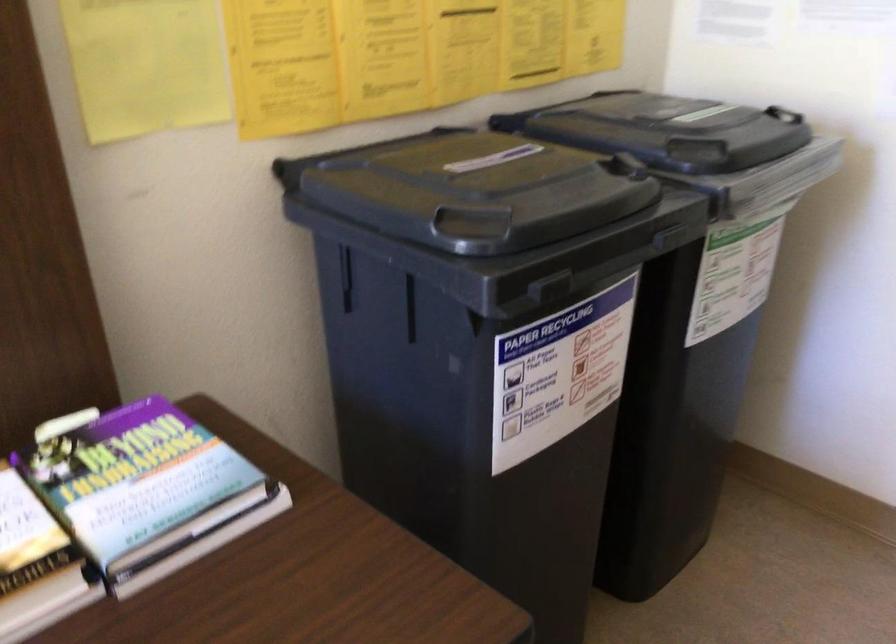
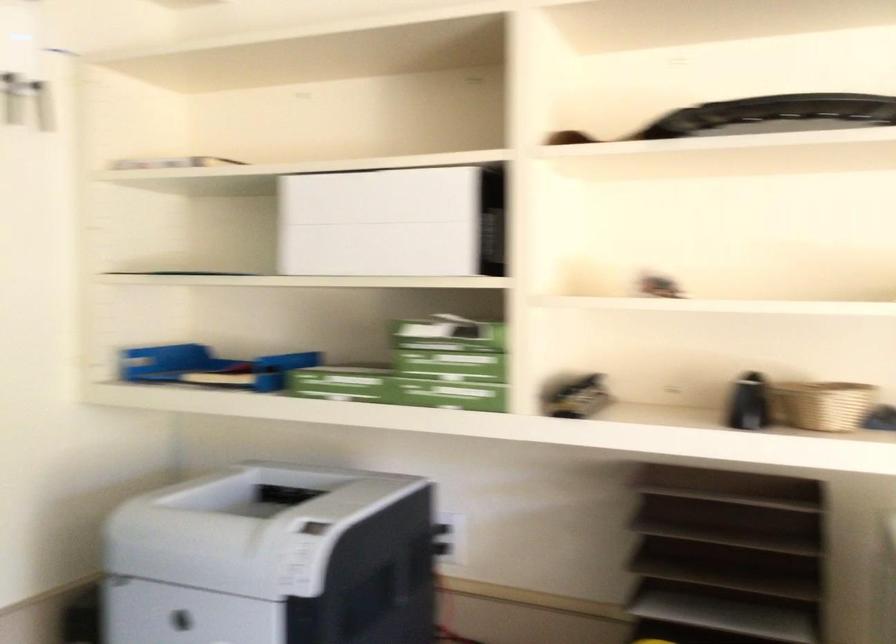
Question: The camera is either moving clockwise (left) or counter-clockwise (right) around the object. The first image is from the beginning of the video and the second image is from the end. Is the camera moving left or right when shooting the video?

Choices:
 (A) Left
 (B) Right

Answer: (A)